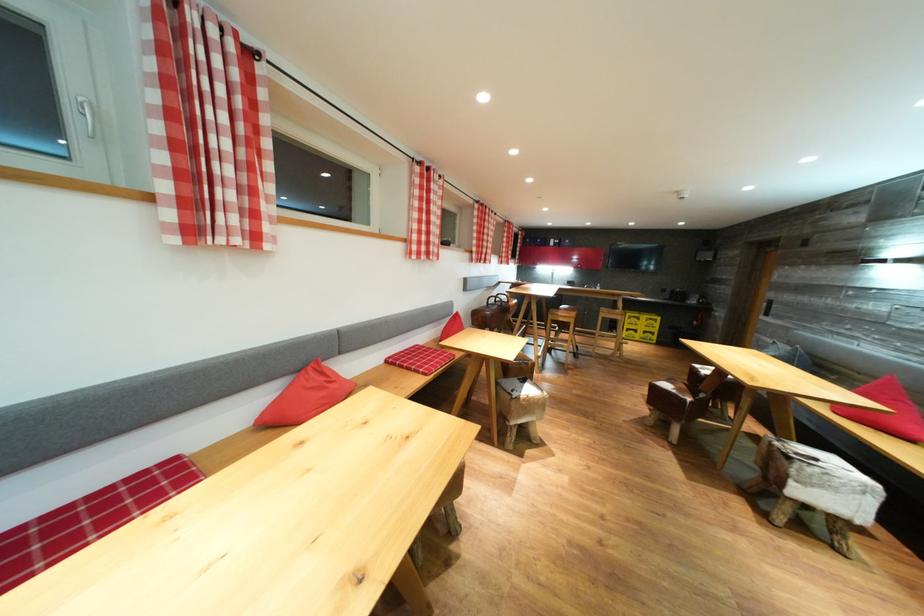
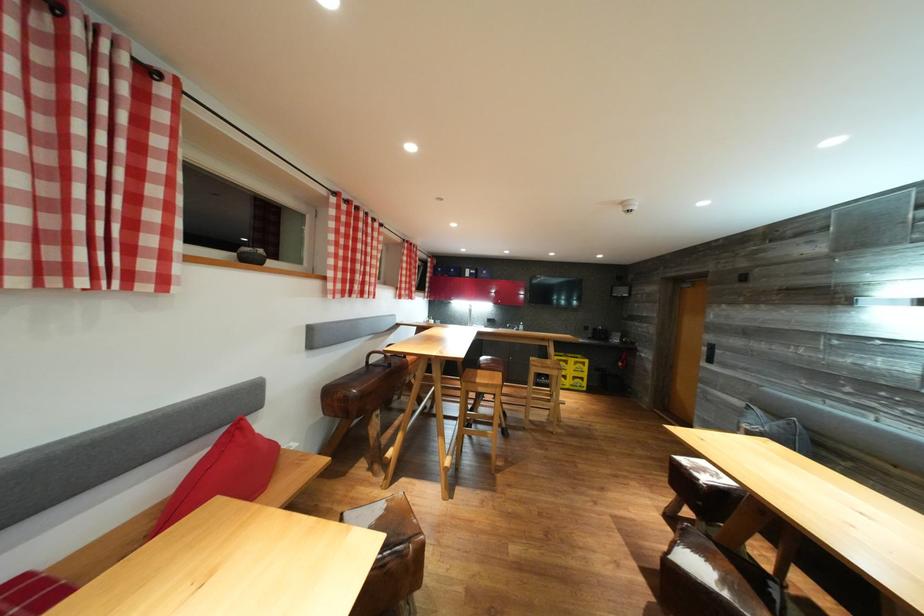
Locate, in the second image, the point that corresponds to the point at 704,371 in the first image.

(689, 466)